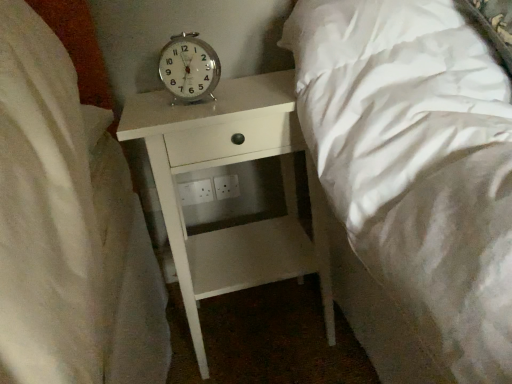
In the scene shown: Measure the distance between point (x=167, y=55) and camera.

They are 35.79 inches apart.

Where is `metallic silver alarm clock at center`? metallic silver alarm clock at center is located at coordinates (189, 68).

The height and width of the screenshot is (384, 512). Describe the element at coordinates (189, 68) in the screenshot. I see `metallic silver alarm clock at center` at that location.

Describe the element at coordinates (230, 164) in the screenshot. I see `white matte nightstand at center` at that location.

This screenshot has height=384, width=512. I want to click on white matte nightstand at center, so click(x=230, y=164).

At what (x,y) coordinates should I click in order to perform the action: click on metallic silver alarm clock at center. Please return your answer as a coordinate pair (x, y). Looking at the image, I should click on (189, 68).

Between white matte nightstand at center and metallic silver alarm clock at center, which one appears on the left side from the viewer's perspective?

From the viewer's perspective, metallic silver alarm clock at center appears more on the left side.

Considering the positions of objects white matte nightstand at center and metallic silver alarm clock at center in the image provided, who is behind, white matte nightstand at center or metallic silver alarm clock at center?

Positioned behind is metallic silver alarm clock at center.

Is point (216, 159) positioned behind point (179, 64)?

No, (216, 159) is closer to viewer.

From the image's perspective, would you say white matte nightstand at center is positioned over metallic silver alarm clock at center?

No.

Consider the image. From a real-world perspective, who is located lower, white matte nightstand at center or metallic silver alarm clock at center?

From a 3D spatial view, white matte nightstand at center is below.

Which of these two, white matte nightstand at center or metallic silver alarm clock at center, is wider?

white matte nightstand at center.

Considering the sizes of objects white matte nightstand at center and metallic silver alarm clock at center in the image provided, who is shorter, white matte nightstand at center or metallic silver alarm clock at center?

metallic silver alarm clock at center.

Looking at the image, does white matte nightstand at center seem bigger or smaller compared to metallic silver alarm clock at center?

Considering their sizes, white matte nightstand at center takes up more space than metallic silver alarm clock at center.

Is metallic silver alarm clock at center located within white matte nightstand at center?

Definitely not — metallic silver alarm clock at center is not inside white matte nightstand at center.

Does white matte nightstand at center touch metallic silver alarm clock at center?

No, white matte nightstand at center is not making contact with metallic silver alarm clock at center.

Is white matte nightstand at center positioned with its back to metallic silver alarm clock at center?

white matte nightstand at center is not turned away from metallic silver alarm clock at center.

Can you tell me how much white matte nightstand at center and metallic silver alarm clock at center differ in facing direction?

They differ by 12 degrees in their facing directions.

How far apart are white matte nightstand at center and metallic silver alarm clock at center?

white matte nightstand at center and metallic silver alarm clock at center are 10.38 inches apart from each other.

Identify the location of alarm clock behind the white matte nightstand at center. (189, 68).

Is metallic silver alarm clock at center at the left side of white matte nightstand at center?

Yes.

Is metallic silver alarm clock at center closer to the viewer compared to white matte nightstand at center?

That is False.

Which is less distant, (197, 58) or (135, 103)?

Positioned in front is point (197, 58).

From the image's perspective, would you say metallic silver alarm clock at center is shown under white matte nightstand at center?

No.

From a real-world perspective, is metallic silver alarm clock at center above or below white matte nightstand at center?

Clearly, from a real-world perspective, metallic silver alarm clock at center is above white matte nightstand at center.

Can you confirm if metallic silver alarm clock at center is wider than white matte nightstand at center?

In fact, metallic silver alarm clock at center might be narrower than white matte nightstand at center.

Based on the photo, considering the sizes of objects metallic silver alarm clock at center and white matte nightstand at center in the image provided, who is shorter, metallic silver alarm clock at center or white matte nightstand at center?

With less height is metallic silver alarm clock at center.

Does metallic silver alarm clock at center have a larger size compared to white matte nightstand at center?

No, metallic silver alarm clock at center is not bigger than white matte nightstand at center.

Is metallic silver alarm clock at center inside the boundaries of white matte nightstand at center, or outside?

metallic silver alarm clock at center is outside white matte nightstand at center.

Is metallic silver alarm clock at center in contact with white matte nightstand at center?

No, metallic silver alarm clock at center is not beside white matte nightstand at center.

Is metallic silver alarm clock at center oriented towards white matte nightstand at center?

No, metallic silver alarm clock at center is not facing towards white matte nightstand at center.

How distant is metallic silver alarm clock at center from white matte nightstand at center?

26.37 centimeters.

Identify the location of alarm clock above the white matte nightstand at center (from a real-world perspective). (189, 68).

In the image, there is a metallic silver alarm clock at center. Where is `nightstand below it (from a real-world perspective)`? The height and width of the screenshot is (384, 512). nightstand below it (from a real-world perspective) is located at coordinates (230, 164).

I want to click on alarm clock behind the white matte nightstand at center, so click(x=189, y=68).